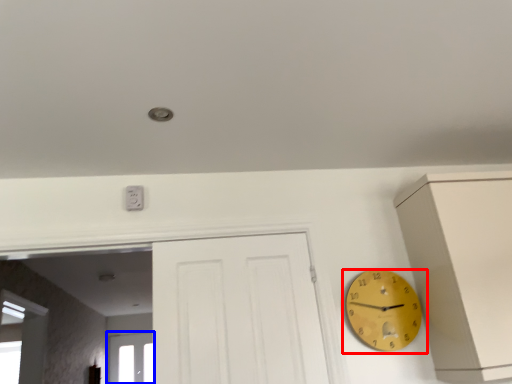
Question: Which of the following is the closest to the observer, wall clock (highlighted by a red box) or window (highlighted by a blue box)?

Choices:
 (A) wall clock
 (B) window

Answer: (A)